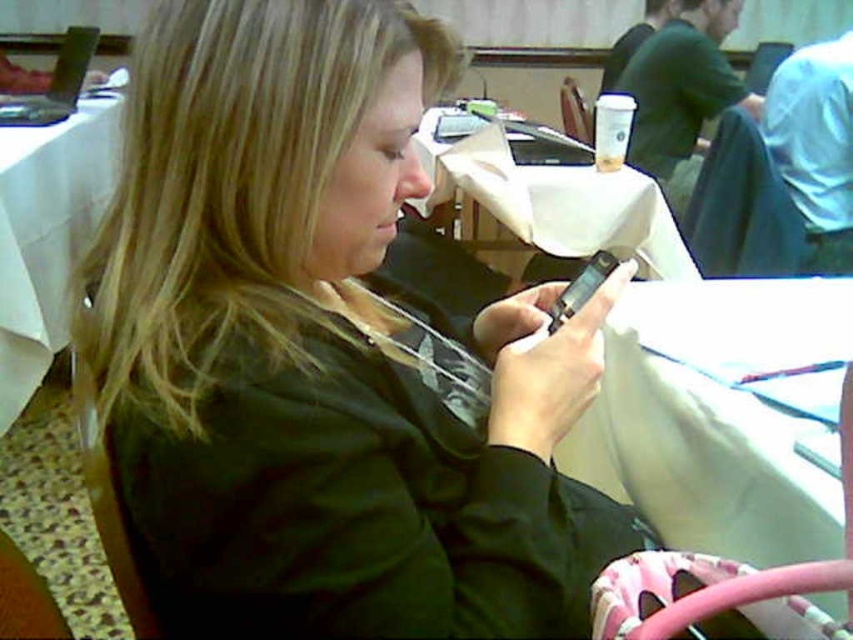
Based on the photo, is white paper at center smaller than white fabric table at lower right?

Incorrect, white paper at center is not smaller in size than white fabric table at lower right.

Does white paper at center appear on the left side of white fabric table at lower right?

Indeed, white paper at center is positioned on the left side of white fabric table at lower right.

Is point (622, 179) less distant than point (662, 586)?

No, it is behind (662, 586).

Find the location of a particular element. The image size is (853, 640). white paper at center is located at coordinates coord(558,202).

Is point (276, 205) positioned before point (781, 237)?

Yes.

Who is more forward, (212, 516) or (759, 232)?

Point (212, 516) is in front.

Identify the location of matte black phone at center. (316, 355).

Between point (309, 314) and point (668, 584), which one is positioned behind?

Positioned behind is point (668, 584).

Which of these two, matte black phone at center or white fabric table at lower right, stands taller?

Standing taller between the two is matte black phone at center.

Does point (318, 224) come closer to viewer compared to point (640, 616)?

That is False.

You are a GUI agent. You are given a task and a screenshot of the screen. Output one action in this format:
    pyautogui.click(x=<x>, y=<y>)
    Task: Click on the matte black phone at center
    The image size is (853, 640).
    Given the screenshot: What is the action you would take?
    pyautogui.click(x=316, y=355)